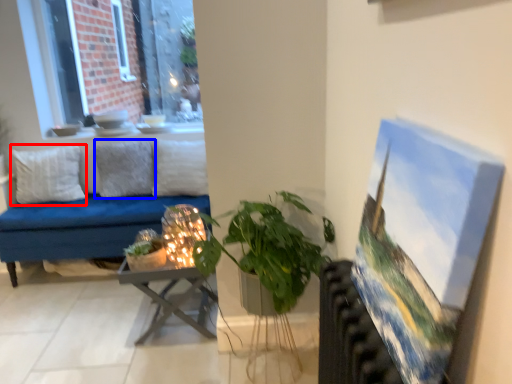
Question: Which object appears farthest to the camera in this image, pillow (highlighted by a red box) or pillow (highlighted by a blue box)?

Choices:
 (A) pillow
 (B) pillow

Answer: (B)